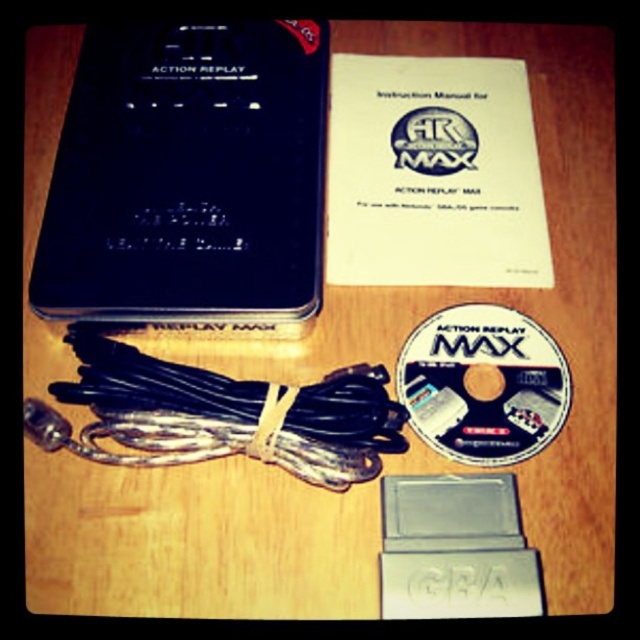
You are organizing a collection of gaming accessories on a desk. You have a black matte action replay max at upper left and a matte white cd at center. Which object is placed higher up on the desk?

The black matte action replay max at upper left is positioned over the matte white cd at center, so it is placed higher up on the desk.

You are organizing a collection of gaming accessories on a desk. You have a black matte action replay max at upper left and a matte white cd at center. Which object is closer to you?

The black matte action replay max at upper left is closer to you because the matte white cd at center is behind it.